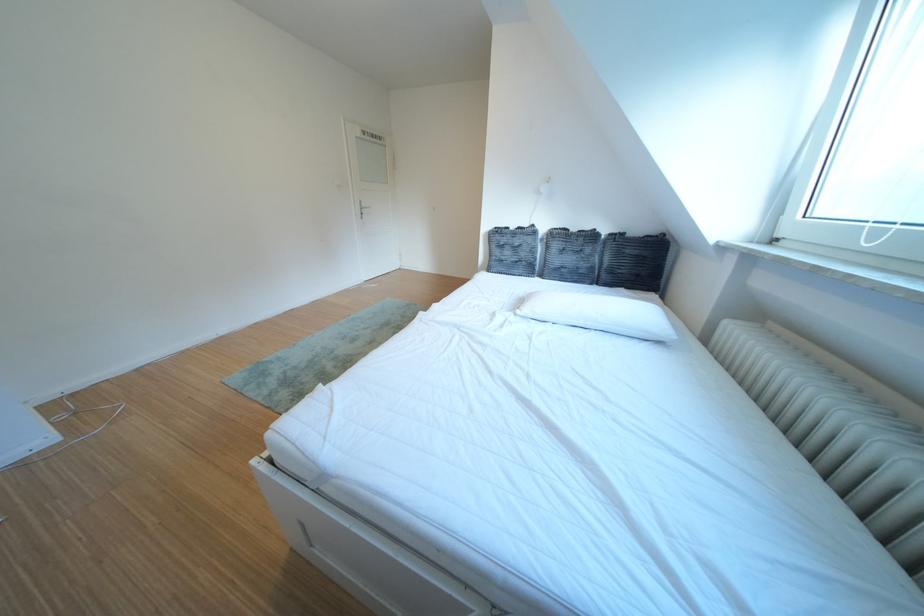
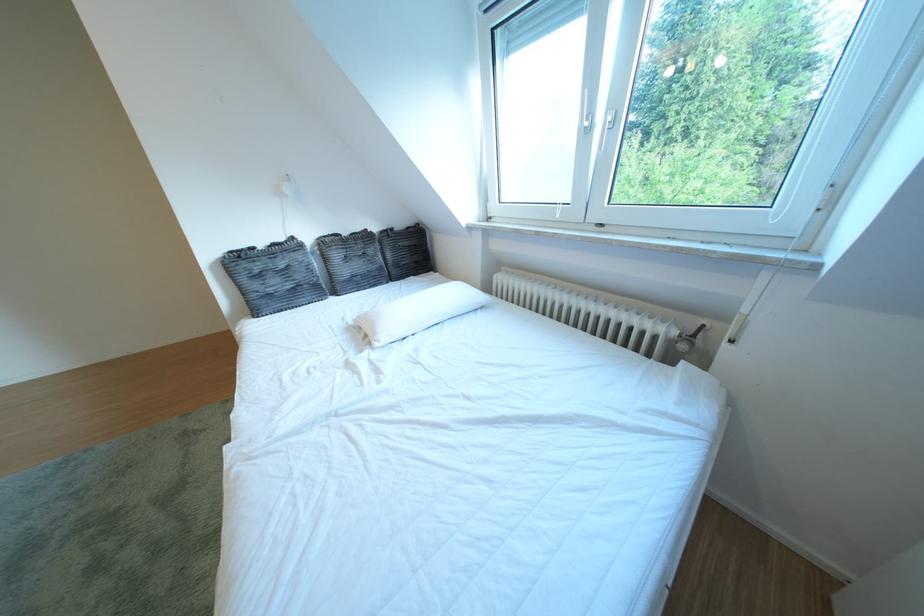
Question: The first image is from the beginning of the video and the second image is from the end. How did the camera likely rotate when shooting the video?

Choices:
 (A) Left
 (B) Right
 (C) Up
 (D) Down

Answer: (B)